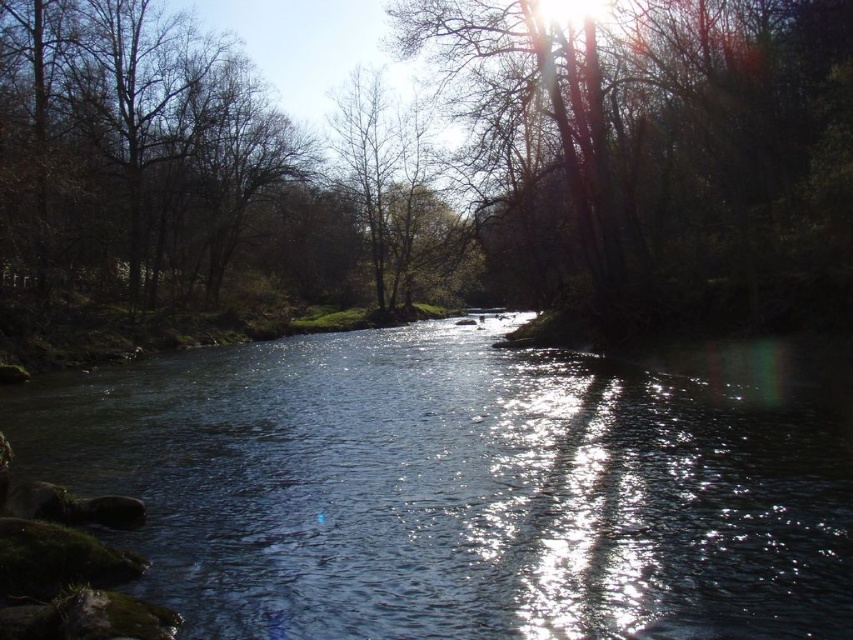
Question: Can you confirm if smooth bark tree at center is positioned above brown leafless tree at left?

Choices:
 (A) yes
 (B) no

Answer: (B)

Question: Where is smooth bark tree at center located in relation to brown leafless tree at left in the image?

Choices:
 (A) right
 (B) left

Answer: (A)

Question: Which of the following is the farthest from the observer?

Choices:
 (A) clear water at center
 (B) smooth bark tree at center

Answer: (B)

Question: Which point appears farthest from the camera in this image?

Choices:
 (A) (45, 396)
 (B) (773, 221)
 (C) (137, 260)

Answer: (C)

Question: Does smooth bark tree at center have a smaller size compared to brown leafless tree at left?

Choices:
 (A) yes
 (B) no

Answer: (A)

Question: Which object appears farthest from the camera in this image?

Choices:
 (A) smooth bark tree at center
 (B) brown leafless tree at left
 (C) clear water at center

Answer: (B)